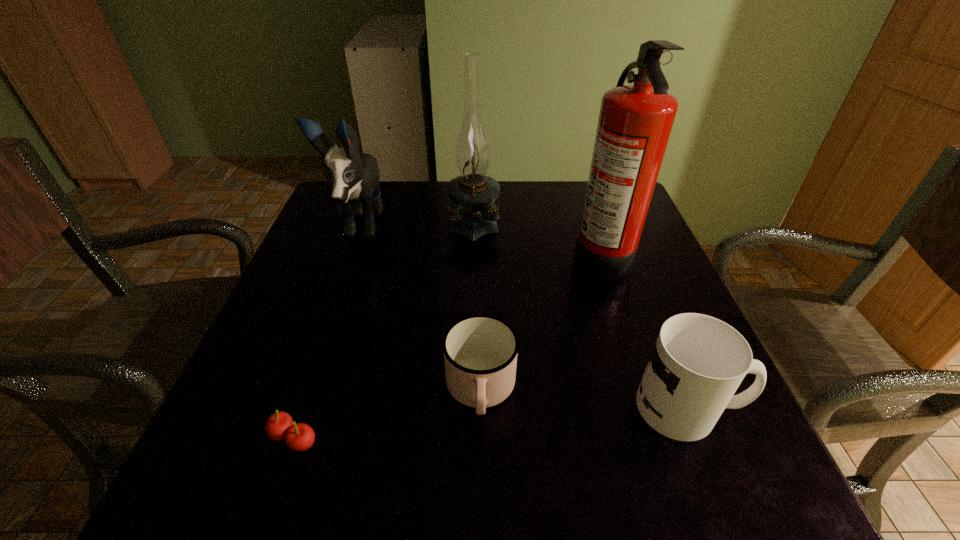
Locate an element on the screen. Image resolution: width=960 pixels, height=540 pixels. the tallest object is located at coordinates (635, 121).

Where is `the second tallest object`? the second tallest object is located at coordinates (475, 214).

The image size is (960, 540). Identify the location of the fourth shortest object. (353, 176).

In order to click on the taller mug in this screenshot , I will do `click(698, 362)`.

You are a GUI agent. You are given a task and a screenshot of the screen. Output one action in this format:
    pyautogui.click(x=<x>, y=<y>)
    Task: Click on the right mug
    Image resolution: width=960 pixels, height=540 pixels.
    Given the screenshot: What is the action you would take?
    pyautogui.click(x=698, y=362)

Where is `the shorter mug`? the shorter mug is located at coordinates [x=480, y=351].

Locate an element on the screen. Image resolution: width=960 pixels, height=540 pixels. the second shortest object is located at coordinates (480, 351).

Identify the location of the shortest object. Image resolution: width=960 pixels, height=540 pixels. (299, 437).

Identify the location of vacant space located 0.370m on the front-facing side of the fire extinguisher. This screenshot has height=540, width=960. (410, 254).

You are a GUI agent. You are given a task and a screenshot of the screen. Output one action in this format:
    pyautogui.click(x=<x>, y=<y>)
    Task: Click on the vacant space located on the front-facing side of the fire extinguisher
    
    Given the screenshot: What is the action you would take?
    pyautogui.click(x=511, y=254)